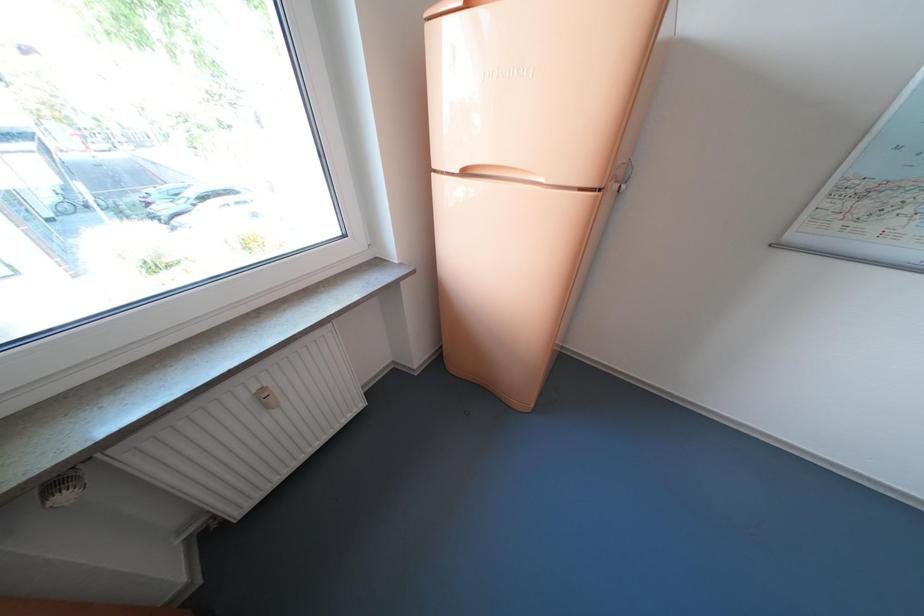
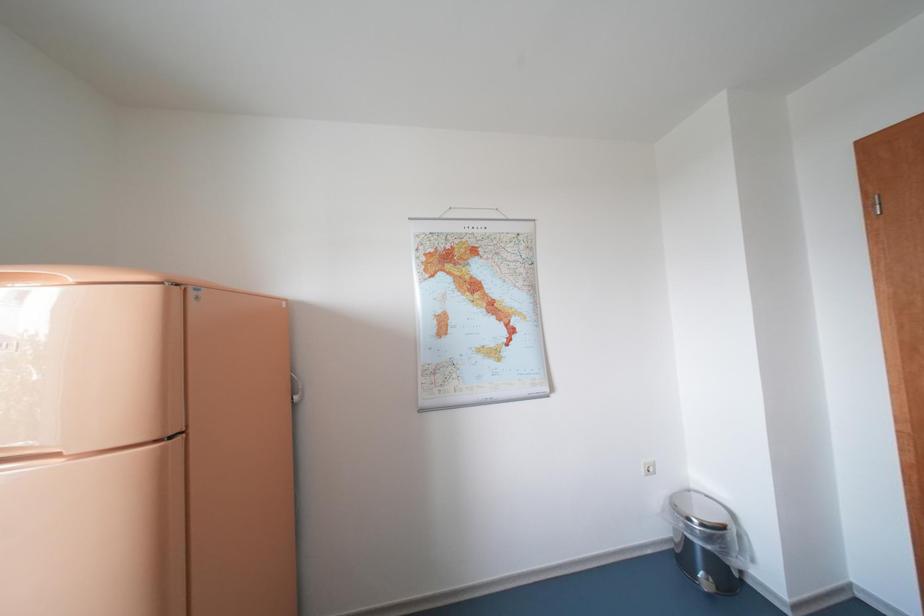
Based on the continuous images, in which direction is the camera rotating?

The camera's rotation is toward right-up.